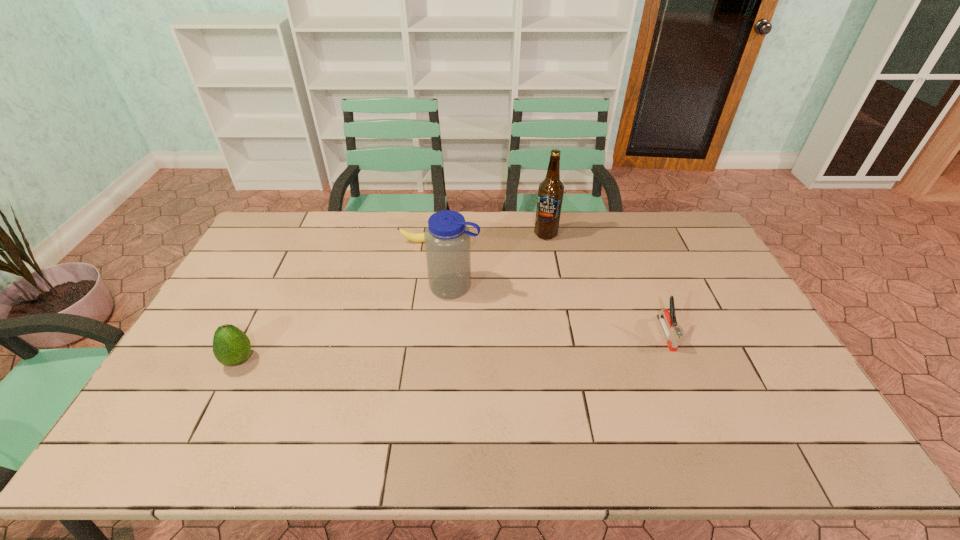
Find the location of a particular element. blank space located on the handle side of the stapler is located at coordinates (690, 392).

The height and width of the screenshot is (540, 960). Find the location of `vacant area situated 0.140m on the upward curve of the banana`. vacant area situated 0.140m on the upward curve of the banana is located at coordinates point(433,271).

Locate an element on the screen. The height and width of the screenshot is (540, 960). blank space located on the upward curve of the banana is located at coordinates (440, 326).

Find the location of a particular element. This screenshot has width=960, height=540. vacant space situated 0.140m on the upward curve of the banana is located at coordinates (433, 271).

Where is `free location located with a carrying loop on the side of the water bottle`? The image size is (960, 540). free location located with a carrying loop on the side of the water bottle is located at coordinates (377, 383).

Image resolution: width=960 pixels, height=540 pixels. Find the location of `free spot located with a carrying loop on the side of the water bottle`. free spot located with a carrying loop on the side of the water bottle is located at coordinates (398, 355).

Image resolution: width=960 pixels, height=540 pixels. I want to click on free region located with a carrying loop on the side of the water bottle, so click(x=381, y=377).

You are a GUI agent. You are given a task and a screenshot of the screen. Output one action in this format:
    pyautogui.click(x=<x>, y=<y>)
    Task: Click on the blank space located 0.320m on the label of the fourth object from left to right
    
    Given the screenshot: What is the action you would take?
    pyautogui.click(x=496, y=293)

At what (x,y) coordinates should I click in order to perform the action: click on vacant space situated 0.260m on the label of the fourth object from left to right. Please return your answer as a coordinate pair (x, y). The width and height of the screenshot is (960, 540). Looking at the image, I should click on (506, 282).

Locate an element on the screen. This screenshot has height=540, width=960. vacant space located 0.180m on the label of the fourth object from left to right is located at coordinates (517, 268).